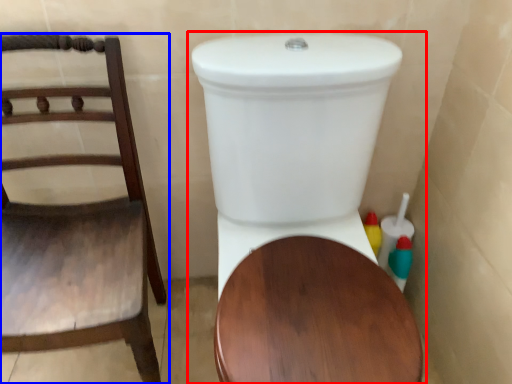
Question: Among these objects, which one is nearest to the camera, toilet (highlighted by a red box) or chair (highlighted by a blue box)?

Choices:
 (A) toilet
 (B) chair

Answer: (A)